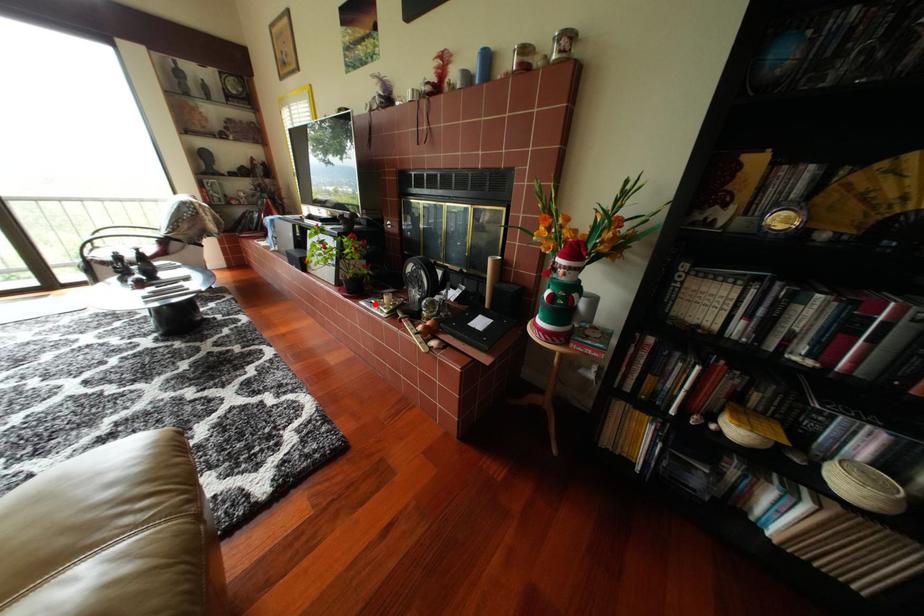
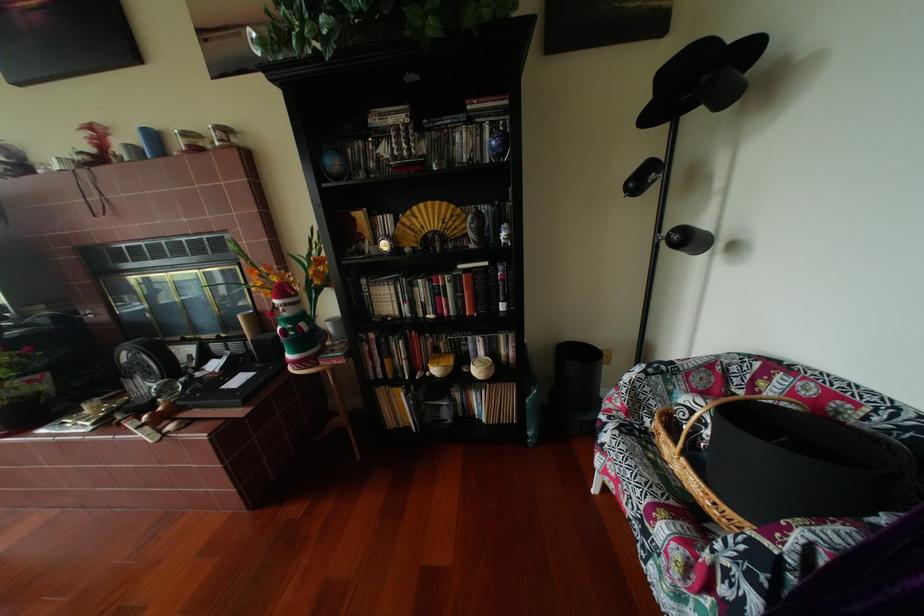
The point at the highlighted location is marked in the first image. Where is the corresponding point in the second image?

(55, 432)